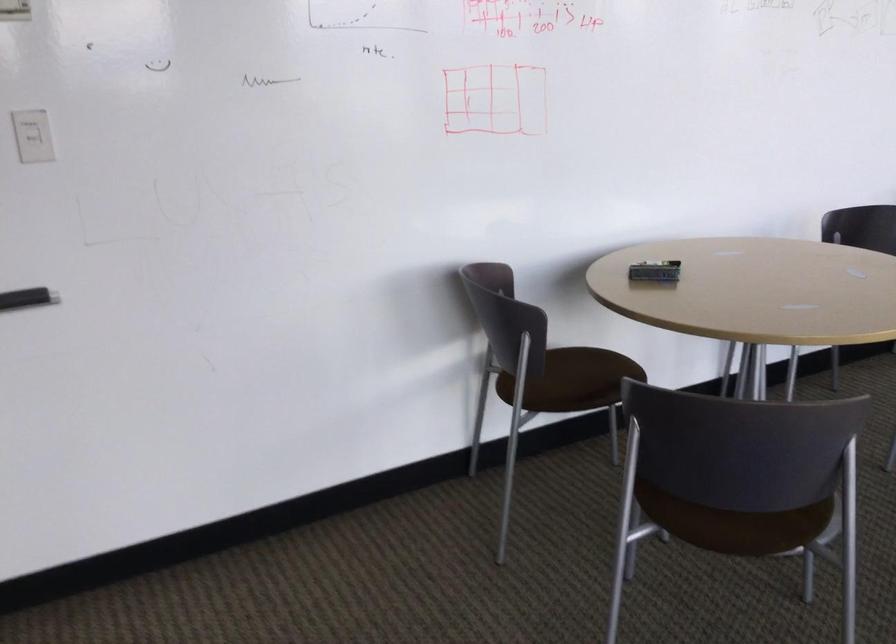
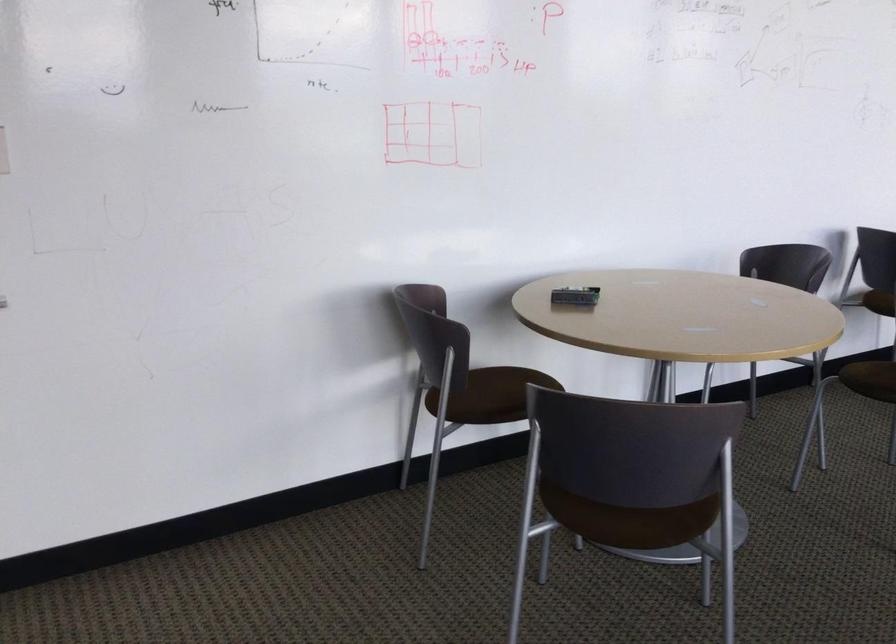
In the second image, find the point that corresponds to point 657,272 in the first image.

(575, 296)